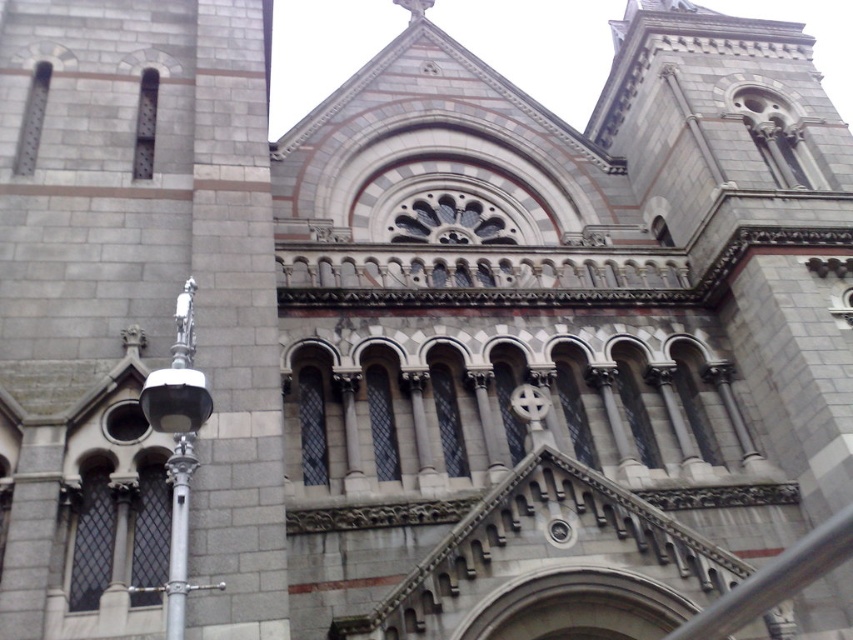
You are a city planner assessing the space between two structures in the image. You need to install a new bench that requires at least 1 meter of clearance. Given the silver metallic streetlight at left and the silver metallic pole at left, which one has a larger width that could potentially block the bench placement?

The silver metallic streetlight at left might be wider than the silver metallic pole at left, so it could potentially block the bench placement if the clearance is insufficient.

You are standing at the entrance of the grand historic building and want to locate the silver metallic streetlight at left. According to the coordinates provided, where would you find it?

The silver metallic streetlight at left is located at coordinates point (x=178, y=449).